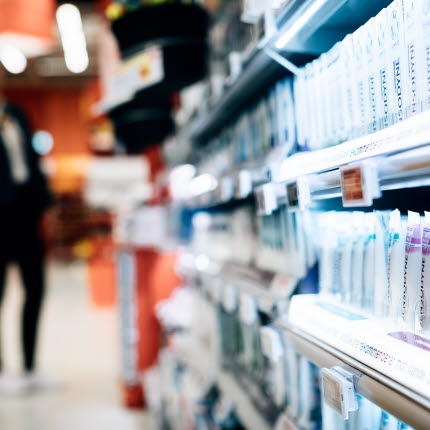
Locate an element on the screen. Image resolution: width=430 pixels, height=430 pixels. label on shelf is located at coordinates pos(333,392).